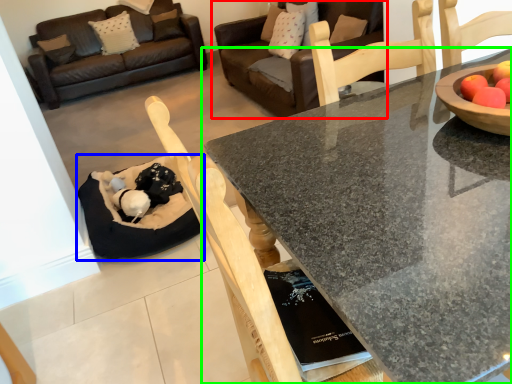
Question: Estimate the real-world distances between objects in this image. Which object is farther from studio couch (highlighted by a red box), cat bed (highlighted by a blue box) or coffee table (highlighted by a green box)?

Choices:
 (A) cat bed
 (B) coffee table

Answer: (B)